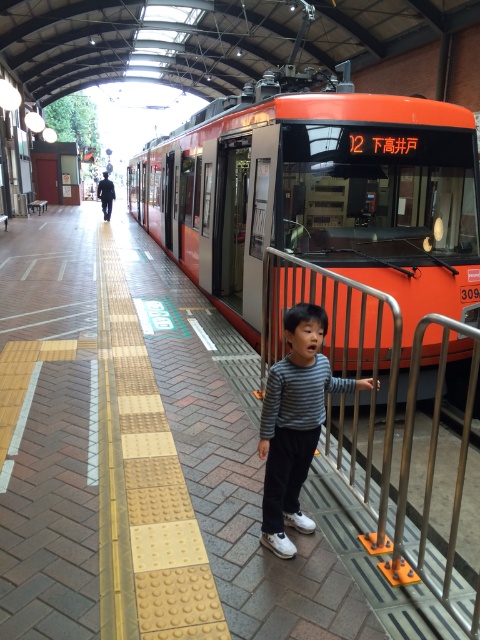
Who is more forward, [469,582] or [283,440]?

Point [283,440] is in front.

Does point (350, 344) come behind point (294, 308)?

Yes, it is behind point (294, 308).

The height and width of the screenshot is (640, 480). I want to click on silver metallic rail at center, so click(x=388, y=426).

Who is more distant from viewer, [344,259] or [400,312]?

The point [344,259] is behind.

Who is higher up, orange glossy tram at center or silver metallic rail at center?

orange glossy tram at center is above.

Find the location of a particular element. This screenshot has height=640, width=480. orange glossy tram at center is located at coordinates (317, 193).

I want to click on orange glossy tram at center, so click(x=317, y=193).

Which of these two, orange glossy tram at center or striped fabric child at center, stands taller?

With more height is orange glossy tram at center.

Which is more to the left, orange glossy tram at center or striped fabric child at center?

orange glossy tram at center is more to the left.

Is point (339, 260) farther from viewer compared to point (287, 426)?

Yes, it is behind point (287, 426).

Where is `orange glossy tram at center`? The image size is (480, 640). orange glossy tram at center is located at coordinates (317, 193).